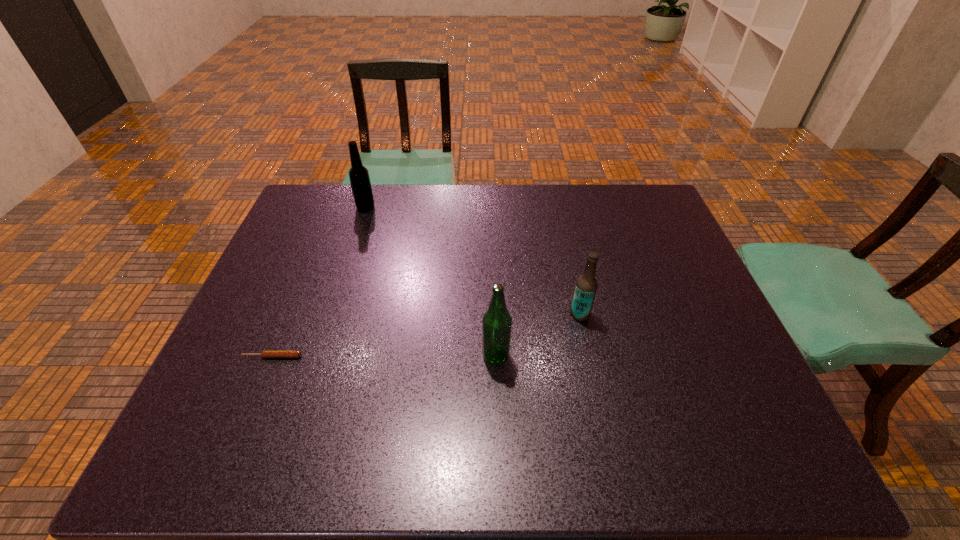
Locate an element on the screen. This screenshot has width=960, height=540. vacant space that is in between the sausage and the second nearest beer bottle is located at coordinates (426, 335).

Find the location of a particular element. The width and height of the screenshot is (960, 540). free spot between the third object from right to left and the second beer bottle from right to left is located at coordinates (431, 282).

Identify the location of free spot between the leftmost beer bottle and the shortest object. (319, 282).

Where is `object that is the closest to the farthest object`? This screenshot has width=960, height=540. object that is the closest to the farthest object is located at coordinates (266, 353).

Where is `object that stands as the third closest to the sausage`? This screenshot has width=960, height=540. object that stands as the third closest to the sausage is located at coordinates (586, 286).

You are a GUI agent. You are given a task and a screenshot of the screen. Output one action in this format:
    pyautogui.click(x=<x>, y=<y>)
    Task: Click on the beer bottle identified as the closest to the third object from left to right
    
    Given the screenshot: What is the action you would take?
    pyautogui.click(x=586, y=286)

Locate which beer bottle is the second closest to the second beer bottle from left to right. Please provide its 2D coordinates. Your answer should be formatted as a tuple, i.e. [(x, y)], where the tuple contains the x and y coordinates of a point satisfying the conditions above.

[(360, 182)]

Find the location of a particular element. This screenshot has width=960, height=540. vacant space that satisfies the following two spatial constraints: 1. on the back side of the second object from left to right; 2. on the left side of the shortest object is located at coordinates (333, 207).